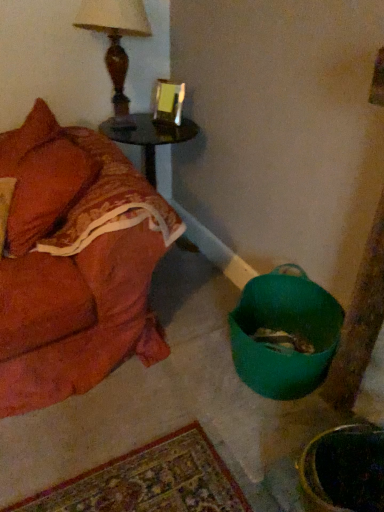
Question: Is wooden table lamp at upper left inside or outside of velvet orange couch at left?

Choices:
 (A) outside
 (B) inside

Answer: (A)

Question: Considering the positions of wooden table lamp at upper left and velvet orange couch at left in the image, is wooden table lamp at upper left taller or shorter than velvet orange couch at left?

Choices:
 (A) short
 (B) tall

Answer: (A)

Question: Considering the real-world distances, which object is closest to the shiny dark wood side table at upper left?

Choices:
 (A) velvet orange couch at left
 (B) green plastic bucket at lower right
 (C) wooden table lamp at upper left

Answer: (C)

Question: Which is nearer to the velvet orange couch at left?

Choices:
 (A) green plastic bucket at lower right
 (B) wooden table lamp at upper left
 (C) shiny dark wood side table at upper left

Answer: (C)